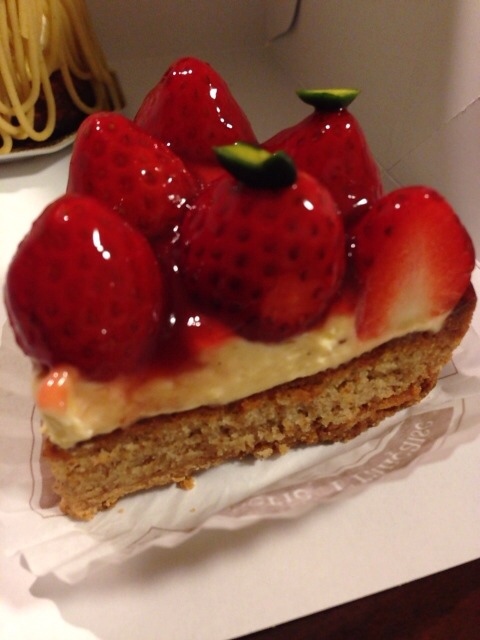
This screenshot has height=640, width=480. Find the location of `white rim dish`. white rim dish is located at coordinates (53, 150).